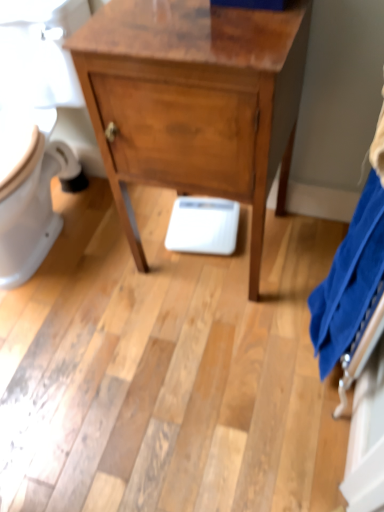
This screenshot has height=512, width=384. Identify the location of free space in front of wooden chest of drawers at center. (213, 346).